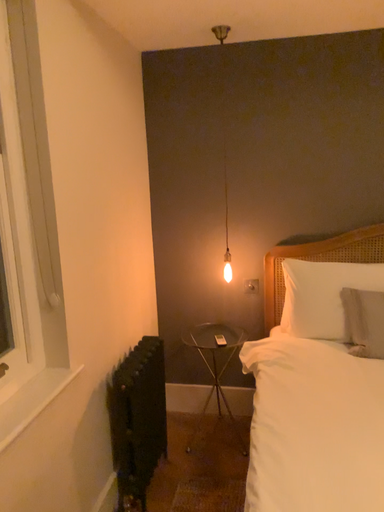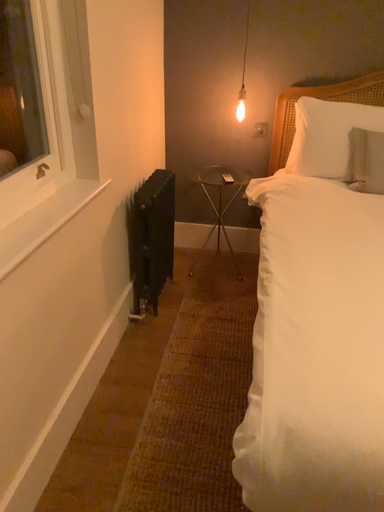
Question: Which way did the camera rotate in the video?

Choices:
 (A) rotated upward
 (B) rotated downward

Answer: (B)